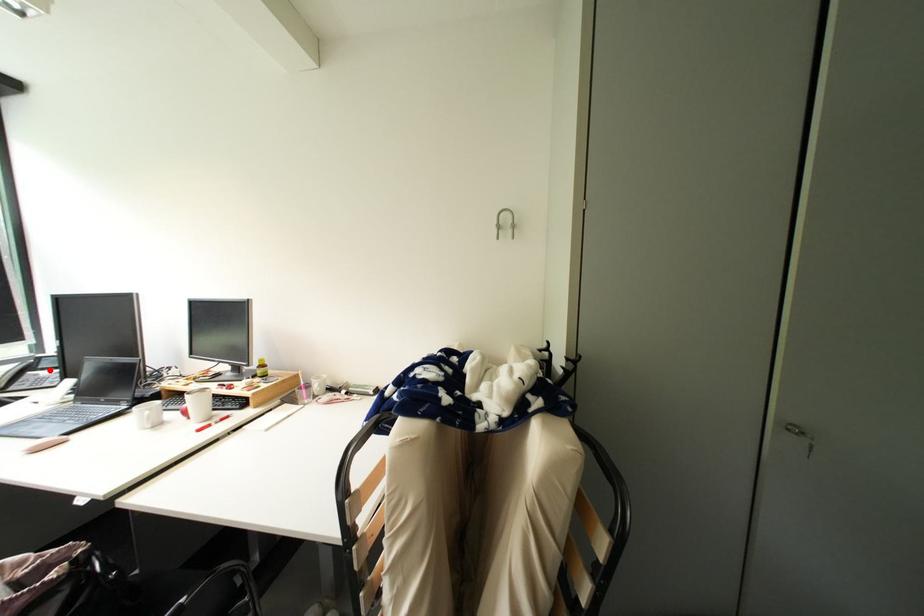
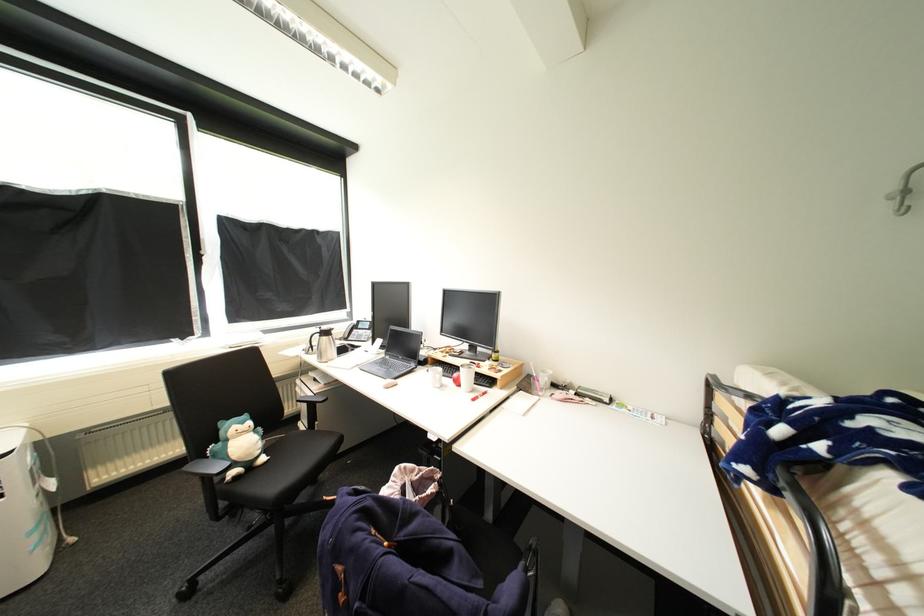
Where in the second image is the point corresponding to the highlighted location from the first image?

(367, 330)